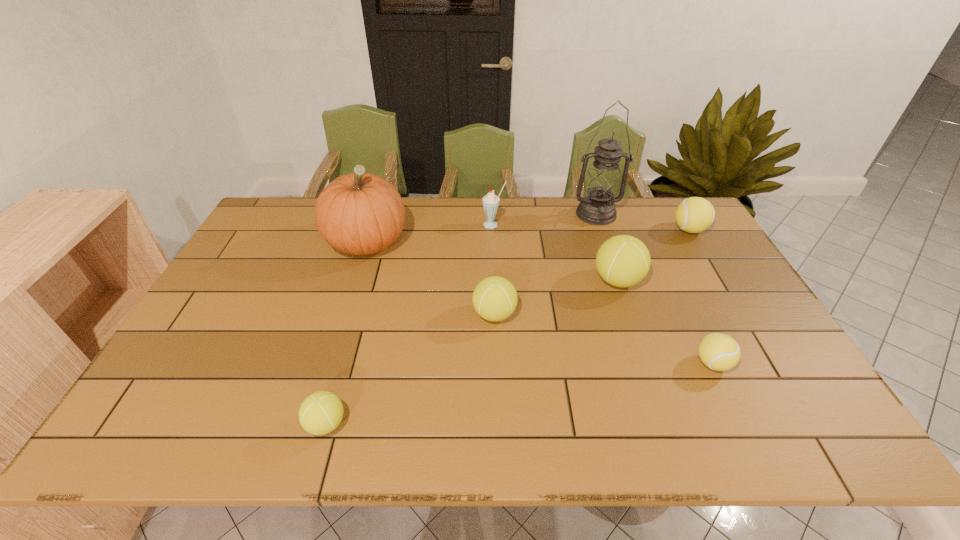
In the image, there is a desktop. Where is `free space at the left edge`? This screenshot has height=540, width=960. free space at the left edge is located at coordinates (231, 288).

The image size is (960, 540). What are the coordinates of `vacant area at the right edge of the desktop` in the screenshot? It's located at (725, 287).

Locate an element on the screen. vacant space at the far left corner of the desktop is located at coordinates (311, 202).

This screenshot has height=540, width=960. What are the coordinates of `vacant space at the near left corner of the desktop` in the screenshot? It's located at (171, 424).

This screenshot has width=960, height=540. I want to click on free space between the third nearest object and the rightmost tennis ball, so click(591, 272).

Identify the location of free space between the tallest object and the leftmost tennis ball. (461, 319).

Locate an element on the screen. free spot between the rightmost green tennis ball and the milkshake is located at coordinates click(x=556, y=253).

The image size is (960, 540). Identify the location of free space between the tallest object and the left yellow tennis ball. (655, 289).

I want to click on vacant space in between the orange pumpkin and the seventh farthest object, so click(540, 303).

I want to click on free point between the oil lamp and the white milkshake, so click(544, 219).